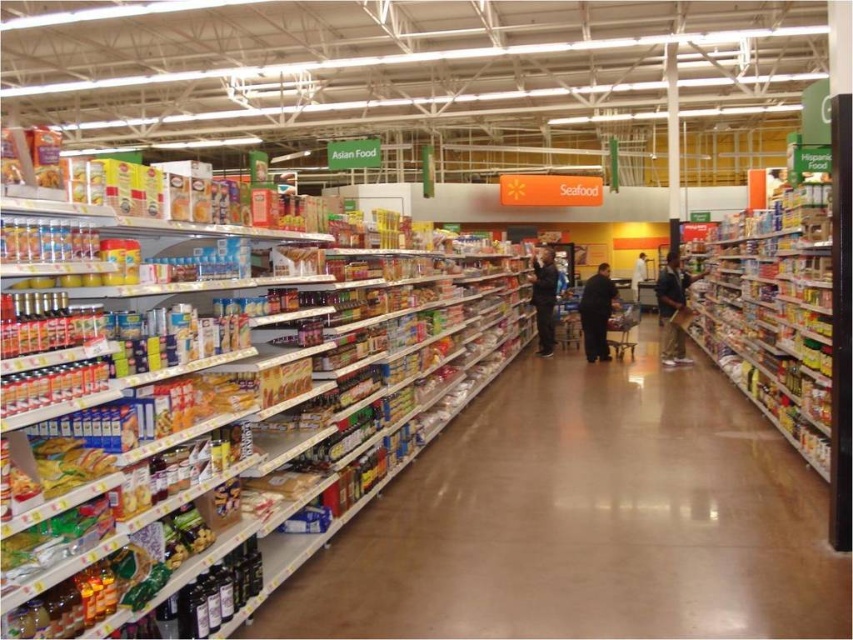
Question: Which is nearer to the dark blue jeans at center?

Choices:
 (A) matte plastic shelf at right
 (B) white fabric person at center
 (C) black matte jacket at center

Answer: (C)

Question: Which object is the farthest from the matte plastic shelf at right?

Choices:
 (A) dark blue jeans at center
 (B) dark blue shirt at center
 (C) white fabric person at center

Answer: (C)

Question: Does shiny brown floor at center have a lesser width compared to black matte jacket at center?

Choices:
 (A) no
 (B) yes

Answer: (A)

Question: Can you confirm if shiny brown floor at center is bigger than dark blue shirt at center?

Choices:
 (A) no
 (B) yes

Answer: (A)

Question: Estimate the real-world distances between objects in this image. Which object is farther from the black matte jacket at center?

Choices:
 (A) matte plastic shelf at right
 (B) dark blue shirt at center

Answer: (A)

Question: Considering the relative positions of black matte jacket at center and dark blue jeans at center in the image provided, where is black matte jacket at center located with respect to dark blue jeans at center?

Choices:
 (A) right
 (B) left

Answer: (A)